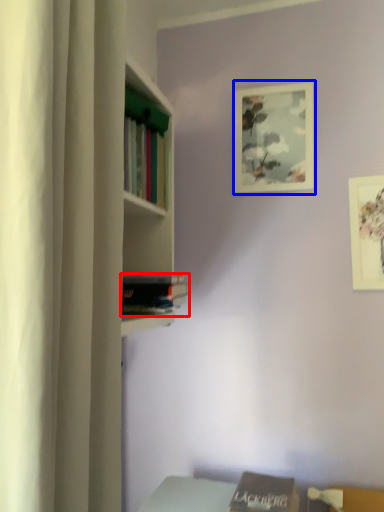
Question: Which object appears closest to the camera in this image, book (highlighted by a red box) or picture frame (highlighted by a blue box)?

Choices:
 (A) book
 (B) picture frame

Answer: (A)